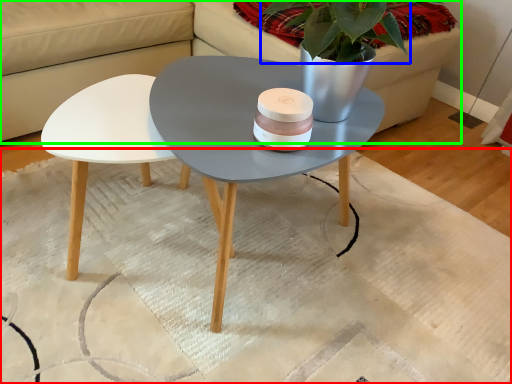
Question: Estimate the real-world distances between objects in this image. Which object is farther from mat (highlighted by a red box), plant (highlighted by a blue box) or couch (highlighted by a green box)?

Choices:
 (A) plant
 (B) couch

Answer: (A)